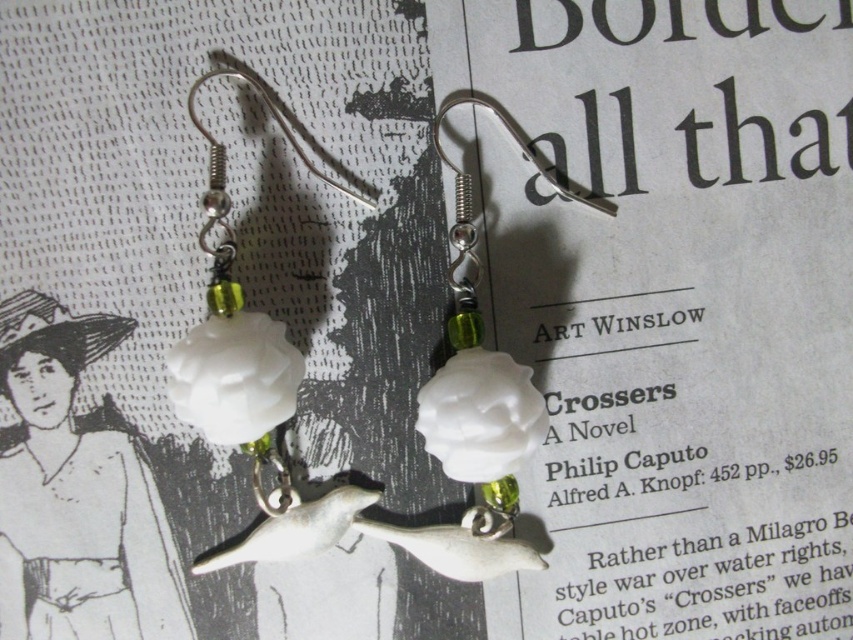
Question: Among these objects, which one is farthest from the camera?

Choices:
 (A) white porcelain flower at center
 (B) matte white porcelain at center

Answer: (B)

Question: Which point is closer to the camera taking this photo?

Choices:
 (A) (447, 365)
 (B) (292, 499)
 (C) (61, 525)

Answer: (C)

Question: From the image, what is the correct spatial relationship of matte white porcelain at center in relation to white porcelain rose at center?

Choices:
 (A) right
 (B) left

Answer: (B)

Question: Is matte white porcelain at center to the right of white porcelain flower at center from the viewer's perspective?

Choices:
 (A) no
 (B) yes

Answer: (A)

Question: Which object appears closest to the camera in this image?

Choices:
 (A) white porcelain flower at center
 (B) white porcelain rose at center
 (C) matte white porcelain at center

Answer: (A)

Question: Is matte white porcelain at center further to camera compared to white porcelain flower at center?

Choices:
 (A) no
 (B) yes

Answer: (B)